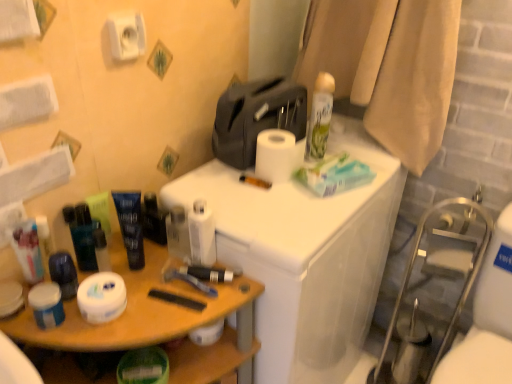
Where is `matte green tube at left, arranged as the third toiletry when viewed from the left`? The image size is (512, 384). matte green tube at left, arranged as the third toiletry when viewed from the left is located at coordinates (101, 212).

Image resolution: width=512 pixels, height=384 pixels. What do you see at coordinates (101, 212) in the screenshot? I see `matte green tube at left, arranged as the third toiletry when viewed from the left` at bounding box center [101, 212].

The height and width of the screenshot is (384, 512). Identify the location of white plastic toilet at upper right, which ranks as the 1th counter in right-to-left order. (304, 258).

This screenshot has height=384, width=512. Identify the location of matte black tube at center, which is counted as the fifth toiletry, starting from the left. (153, 220).

The width and height of the screenshot is (512, 384). Identify the location of white matte toilet paper at upper center, which is the 2th toilet paper from left to right. (126, 35).

This screenshot has width=512, height=384. Describe the element at coordinates (275, 155) in the screenshot. I see `white matte toilet paper at upper center, arranged as the 3th toilet paper when ordered from the bottom` at that location.

What is the approximate height of white matte toilet paper at upper center, arranged as the 3th toilet paper when ordered from the bottom?

white matte toilet paper at upper center, arranged as the 3th toilet paper when ordered from the bottom, is 10.79 centimeters in height.

Where is `matte green tube at left, arranged as the 3th toiletry when viewed from the right`? matte green tube at left, arranged as the 3th toiletry when viewed from the right is located at coordinates click(x=101, y=212).

Is white plastic toilet at upper right, which ranks as the 1th counter in right-to-left order, positioned with its back to matte black tube at center left, the 4th toiletry in the left-to-right sequence?

No, white plastic toilet at upper right, which ranks as the 1th counter in right-to-left order, is not facing away from matte black tube at center left, the 4th toiletry in the left-to-right sequence.

Would you say white plastic toilet at upper right, which ranks as the 1th counter in right-to-left order, is inside or outside matte black tube at center left, the 4th toiletry in the left-to-right sequence?

white plastic toilet at upper right, which ranks as the 1th counter in right-to-left order, is outside matte black tube at center left, the 4th toiletry in the left-to-right sequence.

Considering the sizes of objects white plastic toilet at upper right, which ranks as the 1th counter in right-to-left order, and matte black tube at center left, the 2th toiletry viewed from the right, in the image provided, who is smaller, white plastic toilet at upper right, which ranks as the 1th counter in right-to-left order, or matte black tube at center left, the 2th toiletry viewed from the right,?

matte black tube at center left, the 2th toiletry viewed from the right.

Considering the points (334, 286) and (131, 203), which point is behind, point (334, 286) or point (131, 203)?

The point (334, 286) is more distant.

Identify the location of the 2nd counter below the white matte toilet paper at upper center, which appears as the fourth toilet paper when ordered from the bottom (from the image's perspective). The width and height of the screenshot is (512, 384). (157, 322).

Are woodenmaterial/texturecounter at left, the 1th counter viewed from the left, and white matte toilet paper at upper center, which appears as the fourth toilet paper when ordered from the bottom, far apart?

That's not correct — woodenmaterial/texturecounter at left, the 1th counter viewed from the left, is a little close to white matte toilet paper at upper center, which appears as the fourth toilet paper when ordered from the bottom.

In terms of size, does woodenmaterial/texturecounter at left, the 2th counter from the right, appear bigger or smaller than white matte toilet paper at upper center, which appears as the fourth toilet paper when ordered from the bottom?

In the image, woodenmaterial/texturecounter at left, the 2th counter from the right, appears to be larger than white matte toilet paper at upper center, which appears as the fourth toilet paper when ordered from the bottom.

Is woodenmaterial/texturecounter at left, the 1th counter viewed from the left, wider than white matte toilet paper at upper center, the 3th toilet paper positioned from the right?

Indeed, woodenmaterial/texturecounter at left, the 1th counter viewed from the left, has a greater width compared to white matte toilet paper at upper center, the 3th toilet paper positioned from the right.

Where is `the 1st toilet paper positioned below the white matte toilet paper at upper center, which ranks as the 2th toilet paper in top-to-bottom order (from a real-world perspective)`? The height and width of the screenshot is (384, 512). the 1st toilet paper positioned below the white matte toilet paper at upper center, which ranks as the 2th toilet paper in top-to-bottom order (from a real-world perspective) is located at coordinates (202, 234).

Would you say white glossy toilet paper at center, which appears as the second toilet paper when ordered from the bottom, is to the left or to the right of white matte toilet paper at upper center, arranged as the 3th toilet paper when ordered from the bottom, in the picture?

From the image, it's evident that white glossy toilet paper at center, which appears as the second toilet paper when ordered from the bottom, is to the left of white matte toilet paper at upper center, arranged as the 3th toilet paper when ordered from the bottom.

Do you think white glossy toilet paper at center, marked as the 2th toilet paper in a right-to-left arrangement, is within white matte toilet paper at upper center, which is the 4th toilet paper in left-to-right order, or outside of it?

white glossy toilet paper at center, marked as the 2th toilet paper in a right-to-left arrangement, cannot be found inside white matte toilet paper at upper center, which is the 4th toilet paper in left-to-right order.

Could you measure the distance between white glossy toilet paper at center, arranged as the 3th toilet paper when viewed from the left, and white matte toilet paper at upper center, arranged as the 3th toilet paper when ordered from the bottom?

white glossy toilet paper at center, arranged as the 3th toilet paper when viewed from the left, is 9.05 inches away from white matte toilet paper at upper center, arranged as the 3th toilet paper when ordered from the bottom.

Would you say matte black tube at center, which is counted as the fifth toiletry, starting from the left, is outside white glossy toilet paper at center, which appears as the second toilet paper when ordered from the bottom?

That's correct, matte black tube at center, which is counted as the fifth toiletry, starting from the left, is outside of white glossy toilet paper at center, which appears as the second toilet paper when ordered from the bottom.

Is matte black tube at center, which is counted as the fifth toiletry, starting from the left, smaller than white glossy toilet paper at center, arranged as the 3th toilet paper when viewed from the left?

Yes, matte black tube at center, which is counted as the fifth toiletry, starting from the left, is smaller than white glossy toilet paper at center, arranged as the 3th toilet paper when viewed from the left.

From a real-world perspective, who is located higher, matte black tube at center, which is counted as the fifth toiletry, starting from the left, or white glossy toilet paper at center, which appears as the second toilet paper when ordered from the bottom?

From a 3D spatial view, white glossy toilet paper at center, which appears as the second toilet paper when ordered from the bottom, is above.

Between shiny blue tube at center left, the 4th toiletry from the right, and woodenmaterial/texturecounter at left, the 2th counter from the right, which one is positioned in front?

Positioned in front is woodenmaterial/texturecounter at left, the 2th counter from the right.

Which object is positioned more to the left, shiny blue tube at center left, the 4th toiletry from the right, or woodenmaterial/texturecounter at left, the 2th counter from the right?

shiny blue tube at center left, the 4th toiletry from the right, is more to the left.

Locate an element on the screen. This screenshot has width=512, height=384. the 2nd counter in front of the shiny blue tube at center left, which is counted as the second toiletry, starting from the left, starting your count from the anchor is located at coordinates (157, 322).

Is woodenmaterial/texturecounter at left, the 2th counter from the right, at the back of shiny blue tube at center left, the 4th toiletry from the right?

shiny blue tube at center left, the 4th toiletry from the right, is not turned away from woodenmaterial/texturecounter at left, the 2th counter from the right.

Would you say white matte toilet paper at upper center, which appears as the fourth toilet paper when ordered from the bottom, is part of matte black tube at center, which is counted as the fifth toiletry, starting from the left,'s contents?

No.

Considering the relative sizes of matte black tube at center, which is counted as the fifth toiletry, starting from the left, and white matte toilet paper at upper center, which appears as the fourth toilet paper when ordered from the bottom, in the image provided, is matte black tube at center, which is counted as the fifth toiletry, starting from the left, shorter than white matte toilet paper at upper center, which appears as the fourth toilet paper when ordered from the bottom,?

Incorrect, the height of matte black tube at center, which is counted as the fifth toiletry, starting from the left, does not fall short of that of white matte toilet paper at upper center, which appears as the fourth toilet paper when ordered from the bottom.

Is matte black tube at center, which is counted as the fifth toiletry, starting from the left, far from white matte toilet paper at upper center, which is the 2th toilet paper from left to right?

They are positioned close to each other.

In terms of width, does matte black tube at center, which is counted as the fifth toiletry, starting from the left, look wider or thinner when compared to white matte toilet paper at upper center, which appears as the fourth toilet paper when ordered from the bottom?

matte black tube at center, which is counted as the fifth toiletry, starting from the left, is wider than white matte toilet paper at upper center, which appears as the fourth toilet paper when ordered from the bottom.

Which object is positioned more to the right, matte black tube at center left, the 4th toiletry in the left-to-right sequence, or matte black tube at center, which is counted as the fifth toiletry, starting from the left?

matte black tube at center, which is counted as the fifth toiletry, starting from the left.

From the image's perspective, is matte black tube at center left, the 4th toiletry in the left-to-right sequence, located beneath matte black tube at center, arranged as the first toiletry when viewed from the right?

Yes.

From a real-world perspective, which object rests below the other?

matte black tube at center, arranged as the first toiletry when viewed from the right.

What's the angular difference between matte black tube at center left, the 4th toiletry in the left-to-right sequence, and matte black tube at center, arranged as the first toiletry when viewed from the right,'s facing directions?

35.2 degrees separate the facing orientations of matte black tube at center left, the 4th toiletry in the left-to-right sequence, and matte black tube at center, arranged as the first toiletry when viewed from the right.

Locate an element on the screen. This screenshot has height=384, width=512. the 1st counter directly beneath the matte black tube at center left, the 4th toiletry in the left-to-right sequence (from a real-world perspective) is located at coordinates (304, 258).

This screenshot has width=512, height=384. I want to click on the 2nd counter in front when counting from the white matte toilet paper at upper center, the 3th toilet paper positioned from the right, so click(157, 322).

Based on their spatial positions, is woodenmaterial/texturecounter at left, the 1th counter viewed from the left, or matte green tube at left, arranged as the third toiletry when viewed from the left, closer to white matte toilet paper at upper center, which is the 2th toilet paper from left to right?

Among the two, matte green tube at left, arranged as the third toiletry when viewed from the left, is located nearer to white matte toilet paper at upper center, which is the 2th toilet paper from left to right.

Considering their positions, is white matte toilet paper at lower left, the 1th toilet paper positioned from the bottom, positioned further to white glossy toilet paper at center, arranged as the 3th toilet paper when viewed from the left, than matte green tube at left, arranged as the 3th toiletry when viewed from the right?

matte green tube at left, arranged as the 3th toiletry when viewed from the right, lies further to white glossy toilet paper at center, arranged as the 3th toilet paper when viewed from the left, than the other object.

When comparing their distances from white matte jar at left, positioned as the fifth toiletry in right-to-left order, does white matte toilet paper at upper center, which ranks as the 2th toilet paper in top-to-bottom order, or white matte toilet paper at lower left, the 4th toilet paper positioned from the top, seem closer?

white matte toilet paper at lower left, the 4th toilet paper positioned from the top.

When comparing their distances from woodenmaterial/texturecounter at left, the 1th counter viewed from the left, does white matte toilet paper at lower left, the 4th toilet paper positioned from the top, or matte black tube at center left, the 2th toiletry viewed from the right, seem closer?

white matte toilet paper at lower left, the 4th toilet paper positioned from the top, is positioned closer to the anchor woodenmaterial/texturecounter at left, the 1th counter viewed from the left.

Which object lies further to the anchor point white matte toilet paper at upper center, the 3th toilet paper positioned from the right, translucent plastic can at upper right or matte black tube at center left, the 4th toiletry in the left-to-right sequence?

Based on the image, translucent plastic can at upper right appears to be further to white matte toilet paper at upper center, the 3th toilet paper positioned from the right.

Based on their spatial positions, is matte green tube at left, arranged as the third toiletry when viewed from the left, or shiny blue tube at center left, which is counted as the second toiletry, starting from the left, closer to white matte toilet paper at upper center, which is the 4th toilet paper in left-to-right order?

matte green tube at left, arranged as the third toiletry when viewed from the left, is closer to white matte toilet paper at upper center, which is the 4th toilet paper in left-to-right order.

Based on the photo, estimate the real-world distances between objects in this image. Which object is closer to white matte toilet paper at upper center, which ranks as the first toilet paper in top-to-bottom order, white glossy toilet paper at center, arranged as the 3th toilet paper when viewed from the left, or shiny blue tube at center left, the 4th toiletry from the right?

Among the two, shiny blue tube at center left, the 4th toiletry from the right, is located nearer to white matte toilet paper at upper center, which ranks as the first toilet paper in top-to-bottom order.

From the image, which object appears to be farther from woodenmaterial/texturecounter at left, the 1th counter viewed from the left, white matte toilet paper at upper center, the first toilet paper positioned from the right, or white glossy toilet paper at center, which appears as the second toilet paper when ordered from the bottom?

white matte toilet paper at upper center, the first toilet paper positioned from the right, is further to woodenmaterial/texturecounter at left, the 1th counter viewed from the left.

You are a GUI agent. You are given a task and a screenshot of the screen. Output one action in this format:
    pyautogui.click(x=<x>, y=<y>)
    Task: Click on the toiletry located between matte black tube at center left, the 2th toiletry viewed from the right, and translucent plastic can at upper right in the left-right direction
    The height and width of the screenshot is (384, 512).
    Given the screenshot: What is the action you would take?
    pyautogui.click(x=153, y=220)

This screenshot has width=512, height=384. In order to click on shaving cream between white matte toilet paper at upper center, the 3th toilet paper positioned from the right, and white matte toilet paper at lower left, the 4th toilet paper positioned from the top, from top to bottom in this screenshot , I will do (319, 117).

The height and width of the screenshot is (384, 512). What are the coordinates of `counter between white glossy toilet paper at center, which appears as the second toilet paper when ordered from the bottom, and woodenmaterial/texturecounter at left, the 2th counter from the right, in the up-down direction` in the screenshot? It's located at (304, 258).

Where is `toilet paper between white glossy toilet paper at center, marked as the 2th toilet paper in a right-to-left arrangement, and woodenmaterial/texturecounter at left, the 1th counter viewed from the left, from top to bottom`? Image resolution: width=512 pixels, height=384 pixels. toilet paper between white glossy toilet paper at center, marked as the 2th toilet paper in a right-to-left arrangement, and woodenmaterial/texturecounter at left, the 1th counter viewed from the left, from top to bottom is located at coordinates [102, 297].